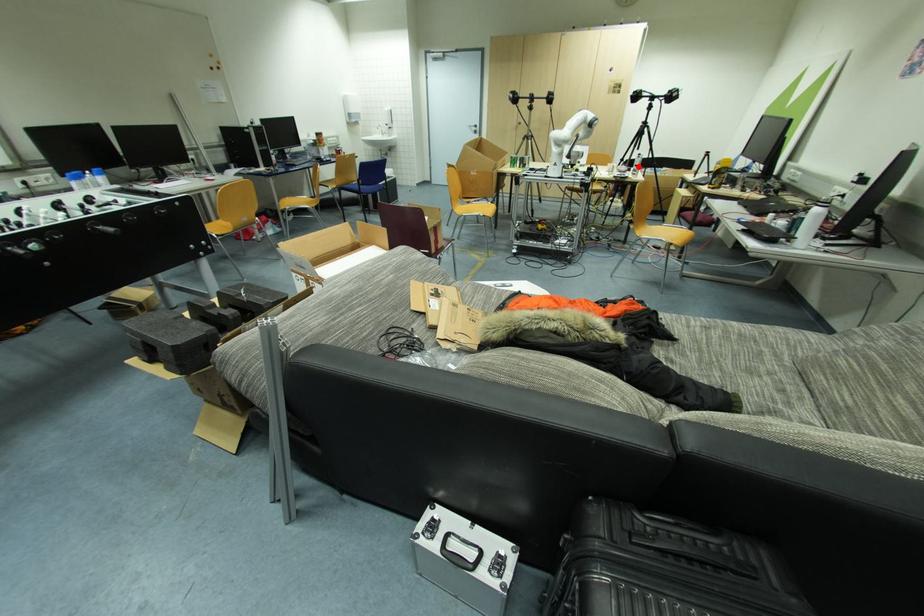
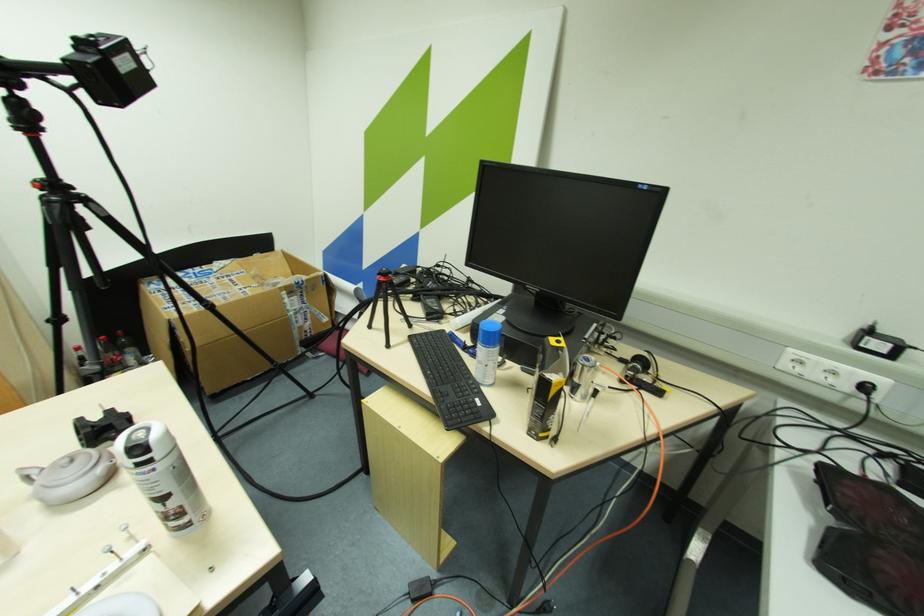
Where in the second image is the point corresponding to the highlighted location from the first image?

(164, 500)